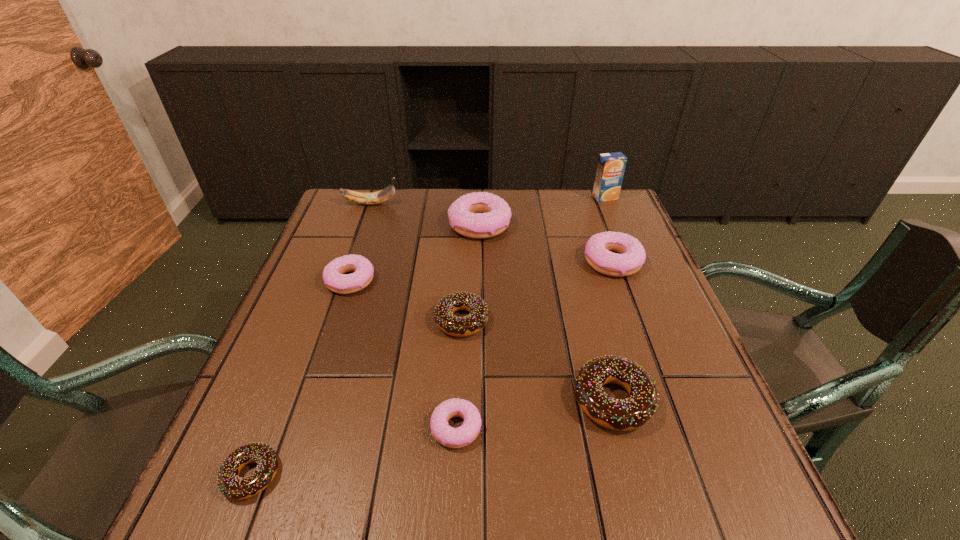
The width and height of the screenshot is (960, 540). Identify the location of vacant point that satisfies the following two spatial constraints: 1. on the peel of the biggest purple doughnut; 2. on the left side of the yellow banana. (363, 225).

Find the location of a particular element. free space that satisfies the following two spatial constraints: 1. on the back side of the leftmost chocolate doughnut; 2. on the right side of the leftmost purple doughnut is located at coordinates (327, 280).

I want to click on vacant region that satisfies the following two spatial constraints: 1. on the peel of the second biggest purple doughnut; 2. on the left side of the yellow banana, so click(350, 261).